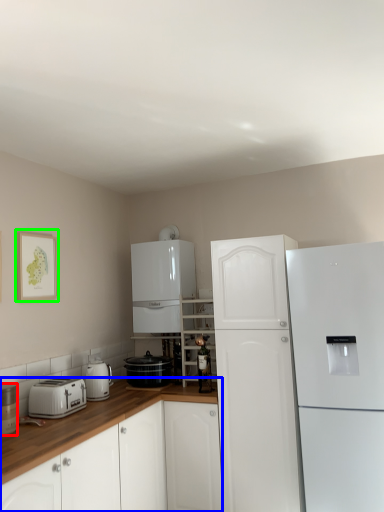
Question: Which object is the farthest from home appliance (highlighted by a red box)? Choose among these: cabinetry (highlighted by a blue box) or picture frame (highlighted by a green box).

Choices:
 (A) cabinetry
 (B) picture frame

Answer: (B)